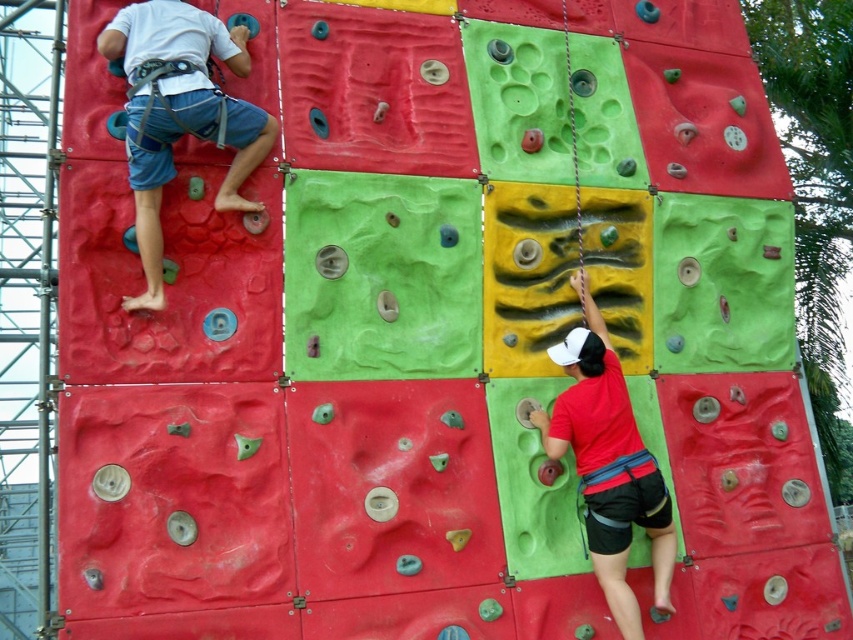
Does matte blue shorts at left appear on the right side of matte red shirt at lower right?

In fact, matte blue shorts at left is to the left of matte red shirt at lower right.

Measure the distance between matte blue shorts at left and matte red shirt at lower right.

They are 41.39 feet apart.

Is point (189, 64) in front of point (630, 625)?

Yes, it is.

Find the location of a particular element. This screenshot has height=640, width=853. matte blue shorts at left is located at coordinates (178, 113).